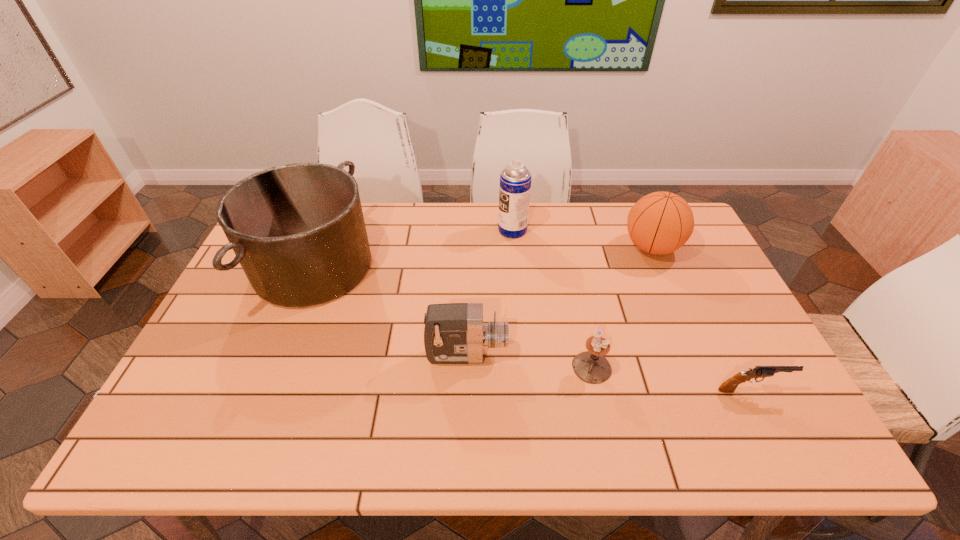
Identify the location of vacant space that satisfies the following two spatial constraints: 1. on the label side of the aerosol can; 2. on the left side of the second shortest object. The width and height of the screenshot is (960, 540). (524, 367).